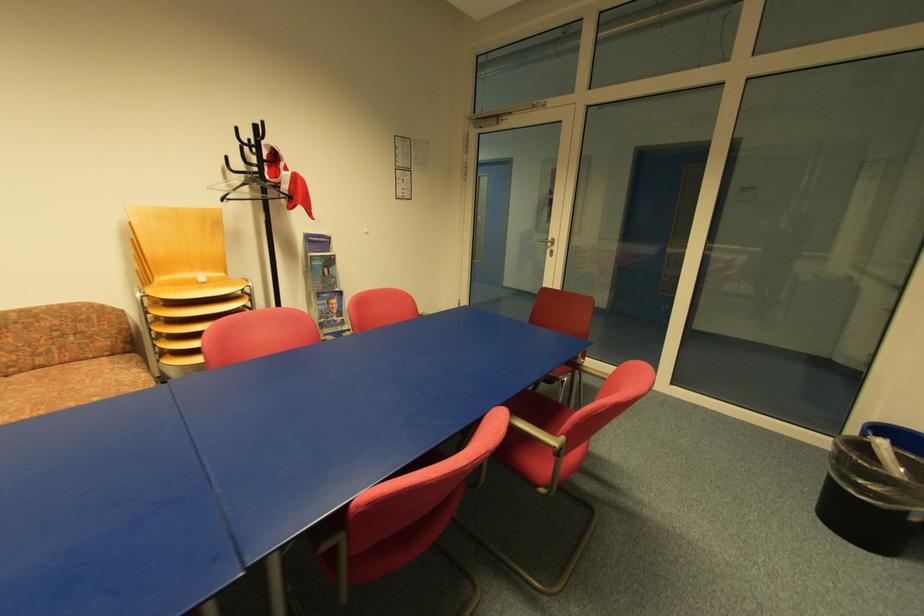
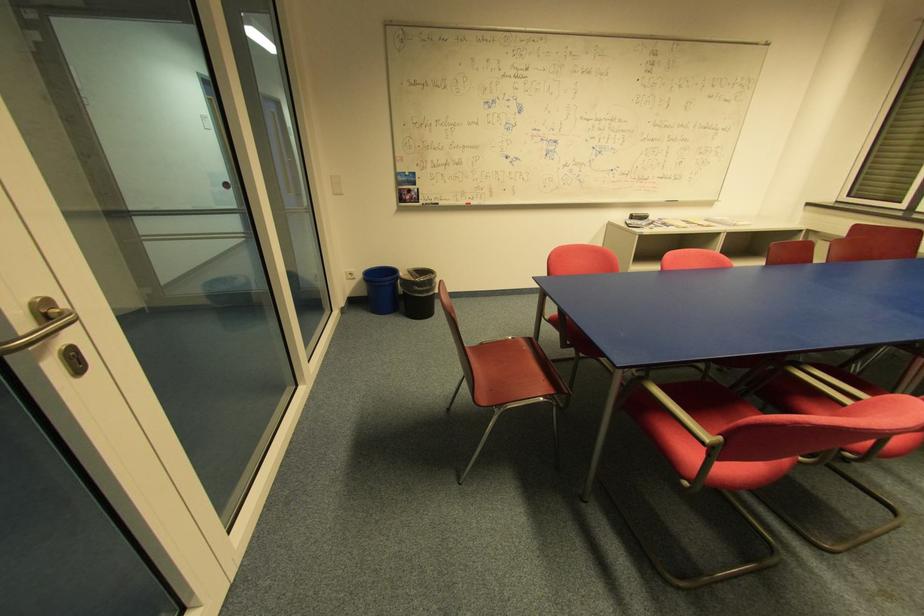
Where in the second image is the point corresponding to [556,240] from the first image?

(51, 304)